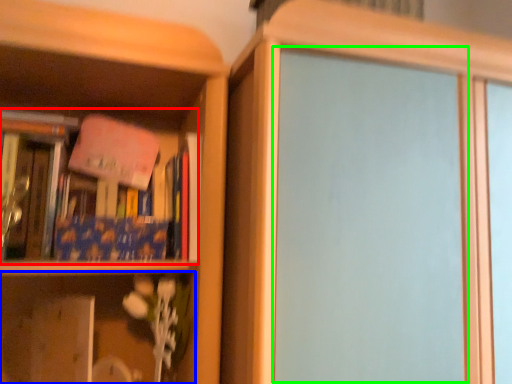
Question: Based on their relative distances, which object is farther from book (highlighted by a red box)? Choose from shelf (highlighted by a blue box) and screen door (highlighted by a green box).

Choices:
 (A) shelf
 (B) screen door

Answer: (B)